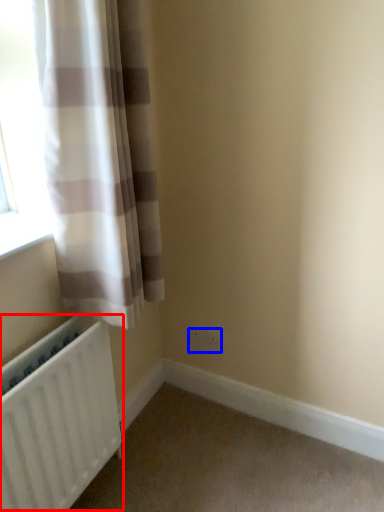
Question: Which object appears closest to the camera in this image, radiator (highlighted by a red box) or electric outlet (highlighted by a blue box)?

Choices:
 (A) radiator
 (B) electric outlet

Answer: (A)